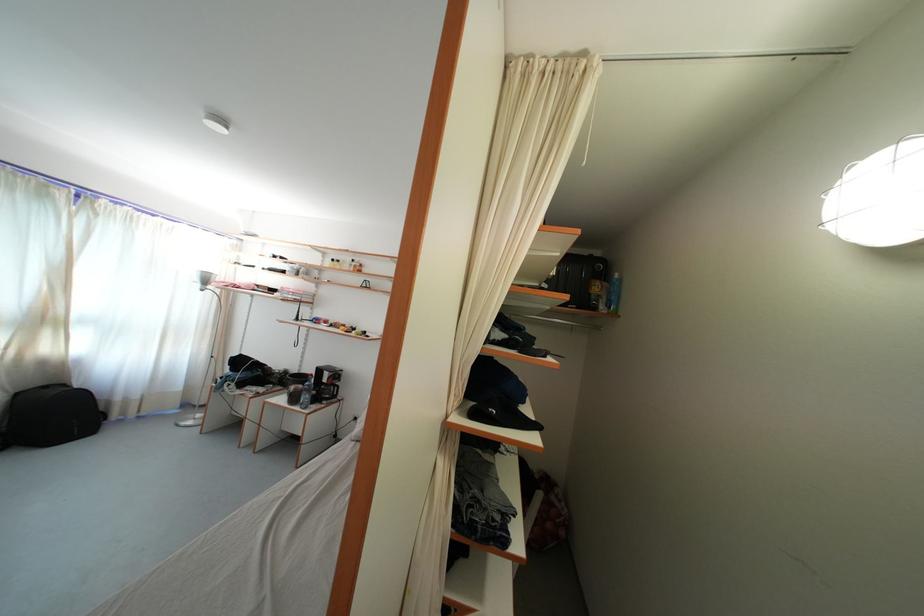
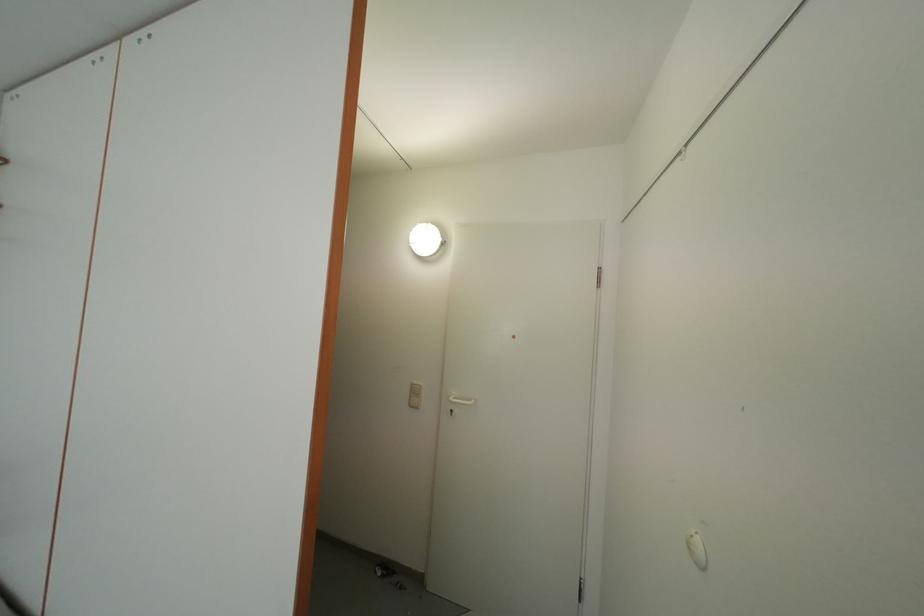
Question: The images are taken continuously from a first-person perspective. In which direction is your viewpoint rotating?

Choices:
 (A) Left
 (B) Right
 (C) Up
 (D) Down

Answer: (B)